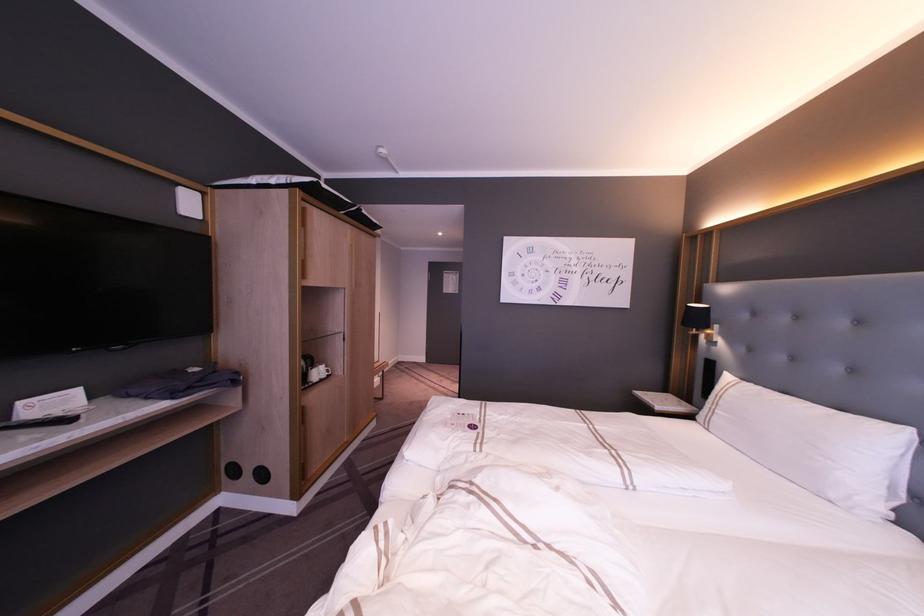
What do you see at coordinates (815, 446) in the screenshot? The height and width of the screenshot is (616, 924). I see `a white bed pillow` at bounding box center [815, 446].